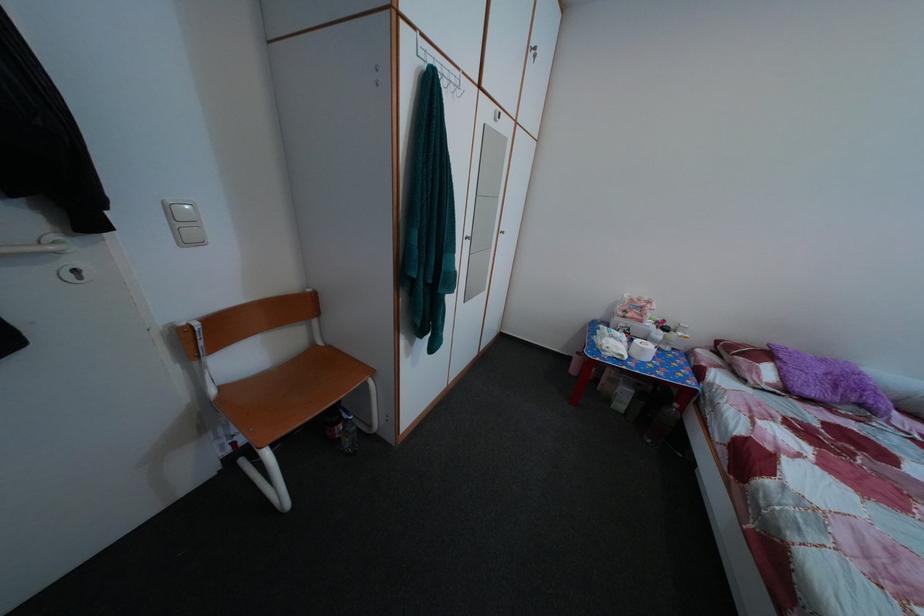
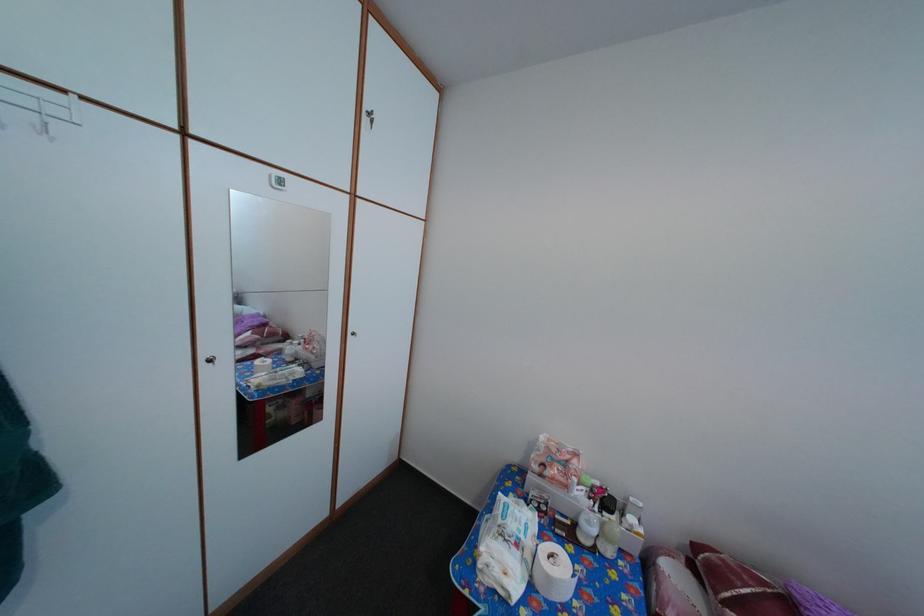
The point at (x=726, y=350) is marked in the first image. Where is the corresponding point in the second image?

(704, 554)